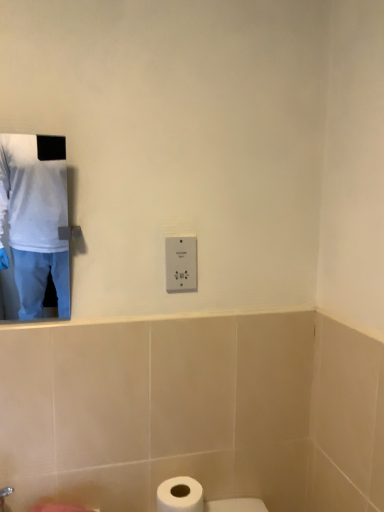
Question: From their relative heights in the image, would you say white plastic switch at center is taller or shorter than white matte toilet paper at lower center?

Choices:
 (A) short
 (B) tall

Answer: (B)

Question: Do you think white plastic switch at center is within white matte toilet paper at lower center, or outside of it?

Choices:
 (A) outside
 (B) inside

Answer: (A)

Question: Which is farther from the white plastic switch at center?

Choices:
 (A) white matte toilet paper at lower center
 (B) white matte shirt at upper left

Answer: (B)

Question: Which object is positioned closest to the white matte toilet paper at lower center?

Choices:
 (A) white plastic switch at center
 (B) white matte shirt at upper left

Answer: (A)